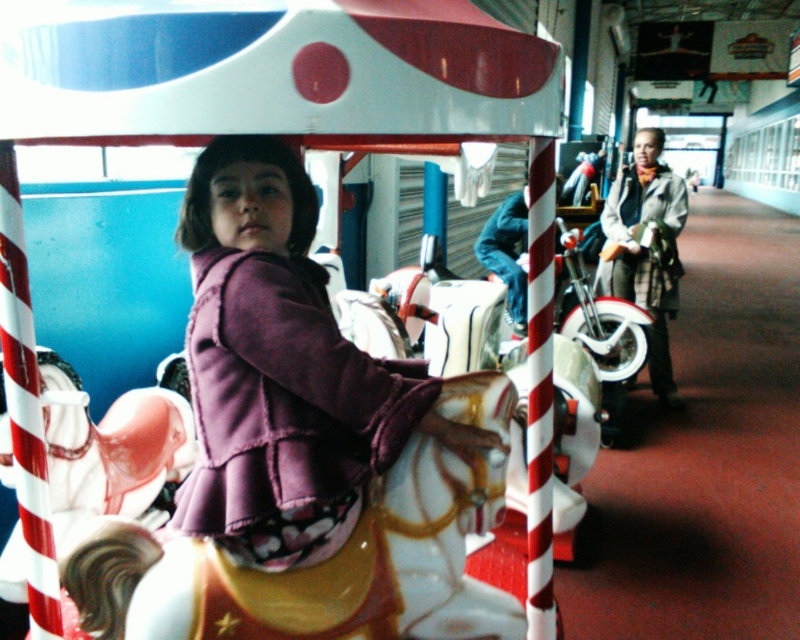
You are at the amusement park and see two motorcycles, the shiny metallic motorcycle at center and the shiny chrome motorcycle at center. Which motorcycle is taller?

The shiny chrome motorcycle at center is taller than the shiny metallic motorcycle at center.

You are standing in the amusement park and see the purple fleece jacket at center and the shiny chrome motorcycle at center. Which object is positioned to the left from your perspective?

The purple fleece jacket at center is to the left of the shiny chrome motorcycle at center.

You are a photographer standing in front of the carousel. You need to capture a photo of both the purple fleece jacket at center and the shiny chrome motorcycle at center. Based on their positions, which object should you focus on first to ensure both are in frame?

The purple fleece jacket at center is above the shiny chrome motorcycle at center, so you should focus on the shiny chrome motorcycle at center first to ensure both are in frame.